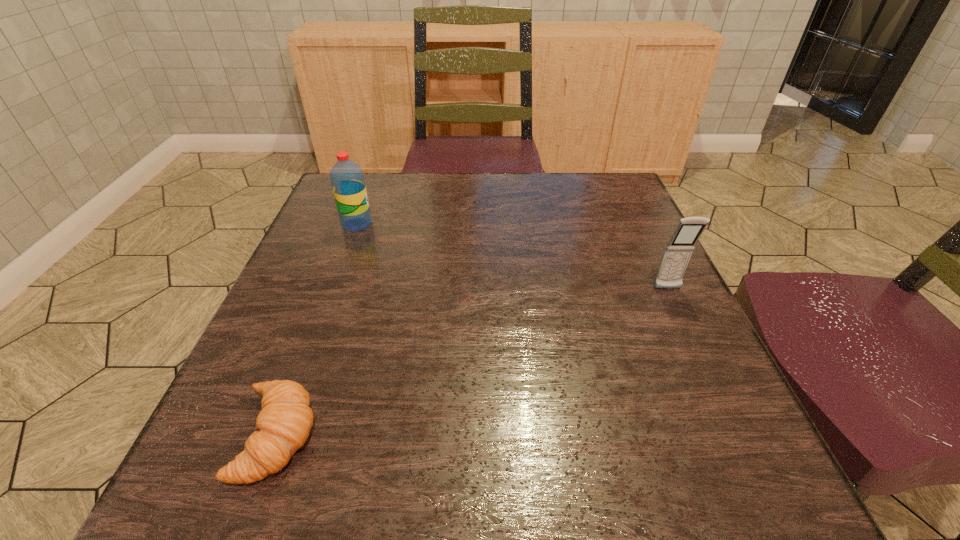
At what (x,y) coordinates should I click in order to perform the action: click on unoccupied position between the cellular telephone and the nearest object. Please return your answer as a coordinate pair (x, y). The height and width of the screenshot is (540, 960). Looking at the image, I should click on [472, 362].

The height and width of the screenshot is (540, 960). I want to click on free spot between the nearest object and the farthest object, so click(317, 330).

Choose which object is the nearest neighbor to the cellular telephone. Please provide its 2D coordinates. Your answer should be formatted as a tuple, i.e. [(x, y)], where the tuple contains the x and y coordinates of a point satisfying the conditions above.

[(284, 423)]

Where is `object that can be found as the second closest to the crescent roll`? The width and height of the screenshot is (960, 540). object that can be found as the second closest to the crescent roll is located at coordinates (678, 251).

This screenshot has height=540, width=960. What are the coordinates of `vacant position in the image that satisfies the following two spatial constraints: 1. on the front label of the farthest object; 2. on the front side of the crescent roll` in the screenshot? It's located at (279, 435).

Find the location of `vacant space that satisfies the following two spatial constraints: 1. on the front label of the water bottle; 2. on the front side of the shortest object`. vacant space that satisfies the following two spatial constraints: 1. on the front label of the water bottle; 2. on the front side of the shortest object is located at coordinates (279, 435).